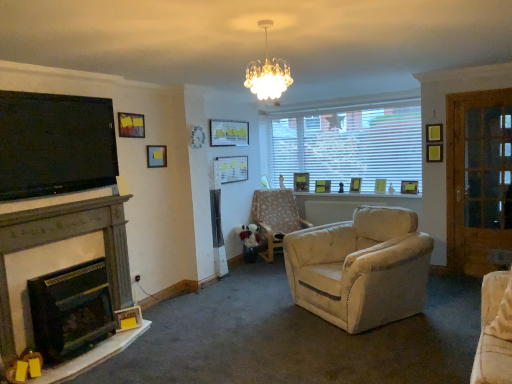
The width and height of the screenshot is (512, 384). Identify the location of empty space that is ontop of dark gray stone fireplace at left, the 1th fireplace when ordered from top to bottom (from a real-world perspective). (61, 211).